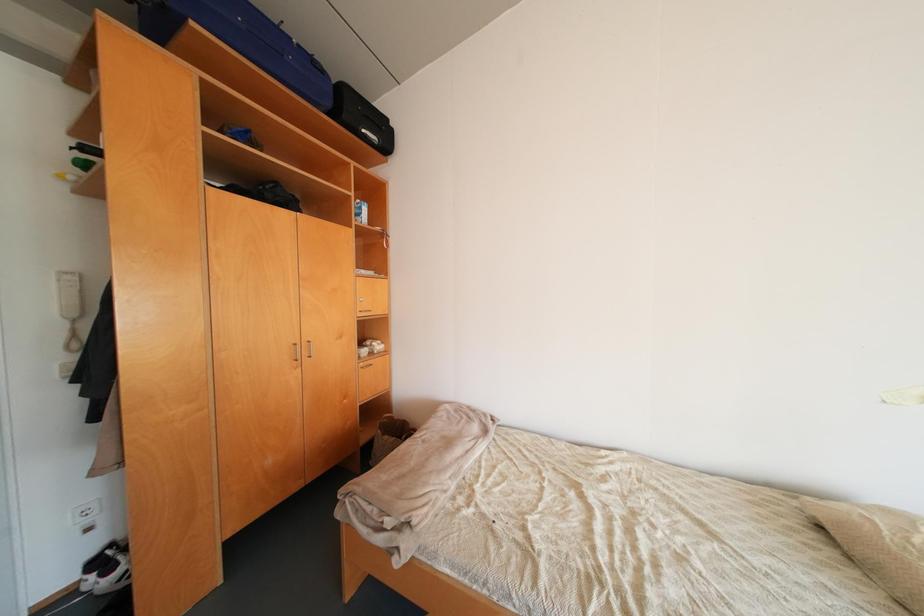
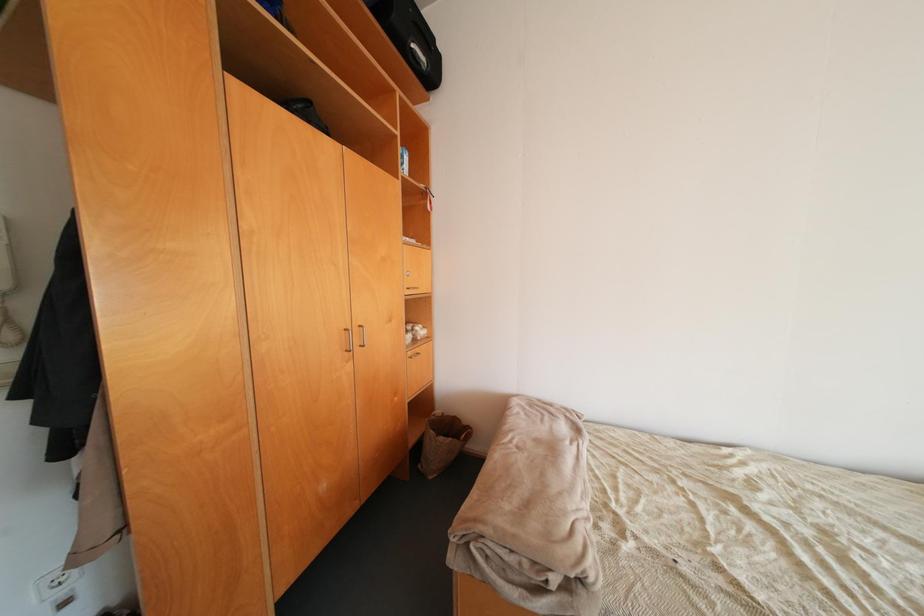
Which direction would the cameraman need to move to produce the second image?

The movement direction of the cameraman is left, forward.